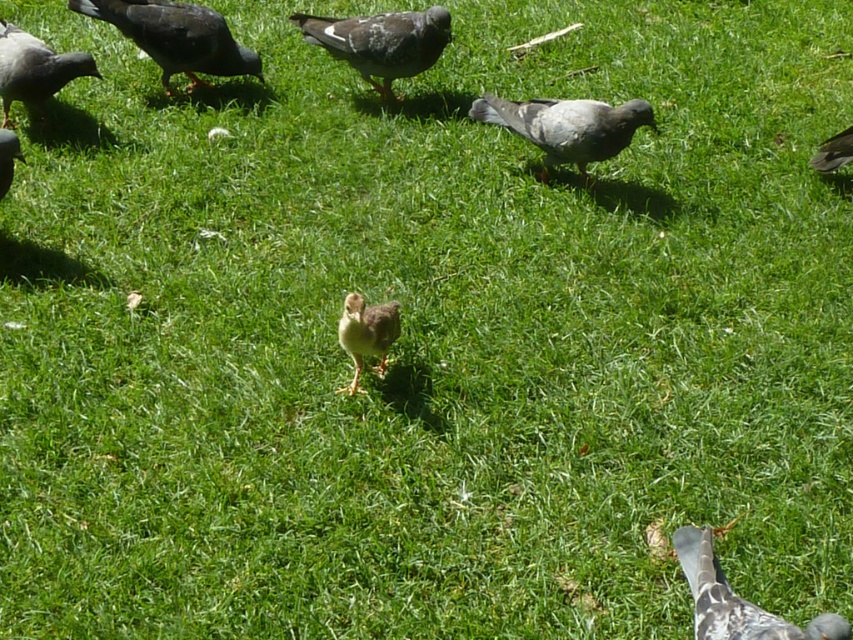
In the scene shown: You are a photographer trying to capture a photo of the speckled feathered pigeon at center and the brown downy chick at center. If you want to frame them so that the pigeon is on the right side of the chick, should you move the camera to your left or right?

The speckled feathered pigeon at center is currently to the left of the brown downy chick at center. To frame them with the pigeon on the right side of the chick, you would need to move the camera to your left so that the pigeon shifts to the right relative to the chick.

You are a birdwatcher observing the scene. You notice the speckled feathered pigeon at center and the brown downy chick at center. Which bird would cast a longer shadow on the grass?

The speckled feathered pigeon at center casts a longer shadow because it is larger than the brown downy chick at center.